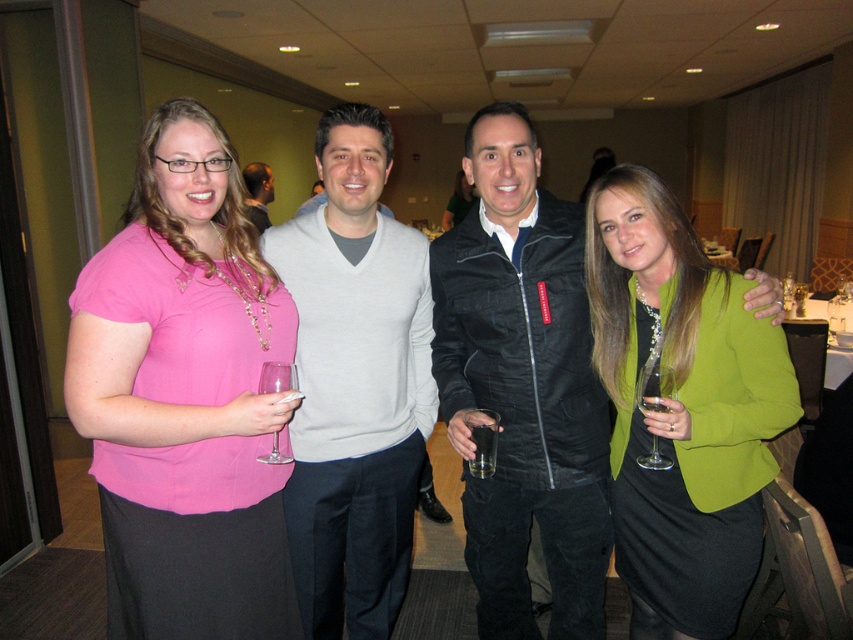
You are a photographer at the event and need to adjust the lighting so that both the light gray sweater at center and the matte green dress at center are well illuminated. Considering their heights, which one might require a higher light source to ensure proper exposure?

The light gray sweater at center is much taller than the matte green dress at center, so the higher light source should be adjusted for the light gray sweater at center to ensure it is properly illuminated.

Where is the light gray sweater at center located in the image?

The light gray sweater at center is located at point (355, 384) in the image.